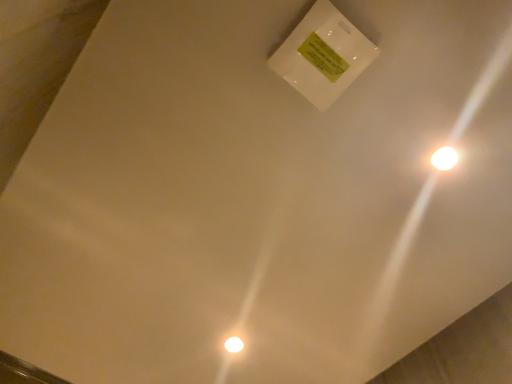
Measure the distance between point (x=234, y=342) and camera.

The depth of point (x=234, y=342) is 4.19 feet.

What do you see at coordinates (234, 344) in the screenshot? The height and width of the screenshot is (384, 512). I see `white glossy light bulb at lower center` at bounding box center [234, 344].

Find the location of a particular element. white glossy light bulb at lower center is located at coordinates (234, 344).

Where is `white glossy light at upper right`? white glossy light at upper right is located at coordinates (444, 158).

Describe the element at coordinates (444, 158) in the screenshot. I see `white glossy light at upper right` at that location.

Measure the distance between white glossy light at upper right and camera.

white glossy light at upper right and camera are 37.83 inches apart.

At what (x,y) coordinates should I click in order to perform the action: click on white glossy light bulb at lower center. Please return your answer as a coordinate pair (x, y). The height and width of the screenshot is (384, 512). Looking at the image, I should click on (234, 344).

Considering the relative positions of white glossy light at upper right and white glossy light bulb at lower center in the image provided, is white glossy light at upper right to the right of white glossy light bulb at lower center from the viewer's perspective?

Indeed, white glossy light at upper right is positioned on the right side of white glossy light bulb at lower center.

Is white glossy light at upper right positioned before white glossy light bulb at lower center?

That is True.

Is point (437, 155) closer or farther from the camera than point (234, 348)?

Clearly, point (437, 155) is closer to the camera than point (234, 348).

From the image's perspective, relative to white glossy light bulb at lower center, is white glossy light at upper right above or below?

Clearly, from the image's perspective, white glossy light at upper right is above white glossy light bulb at lower center.

From a real-world perspective, which object rests below the other?

In real-world perspective, white glossy light bulb at lower center is lower.

Does white glossy light at upper right have a greater width compared to white glossy light bulb at lower center?

No, white glossy light at upper right is not wider than white glossy light bulb at lower center.

Can you confirm if white glossy light at upper right is shorter than white glossy light bulb at lower center?

Yes.

Considering the sizes of white glossy light at upper right and white glossy light bulb at lower center in the image, is white glossy light at upper right bigger or smaller than white glossy light bulb at lower center?

white glossy light at upper right is smaller than white glossy light bulb at lower center.

Would you say white glossy light bulb at lower center is part of white glossy light at upper right's contents?

No, white glossy light bulb at lower center is not inside white glossy light at upper right.

Would you consider white glossy light at upper right to be distant from white glossy light bulb at lower center?

No, there isn't a large distance between white glossy light at upper right and white glossy light bulb at lower center.

Is white glossy light at upper right facing towards white glossy light bulb at lower center?

Yes.

How different are the orientations of white glossy light at upper right and white glossy light bulb at lower center in degrees?

The angle between the facing direction of white glossy light at upper right and the facing direction of white glossy light bulb at lower center is 180 degrees.

Where is `light that appears above the white glossy light bulb at lower center (from a real-world perspective)`? The image size is (512, 384). light that appears above the white glossy light bulb at lower center (from a real-world perspective) is located at coordinates (444, 158).

Is white glossy light bulb at lower center at the left side of white glossy light at upper right?

Correct, you'll find white glossy light bulb at lower center to the left of white glossy light at upper right.

Is white glossy light bulb at lower center behind white glossy light at upper right?

Yes, white glossy light bulb at lower center is behind white glossy light at upper right.

Which is nearer, (240, 348) or (439, 154)?

Point (240, 348).

From the image's perspective, is white glossy light bulb at lower center over white glossy light at upper right?

Actually, white glossy light bulb at lower center appears below white glossy light at upper right in the image.

From a real-world perspective, between white glossy light bulb at lower center and white glossy light at upper right, who is vertically higher?

white glossy light at upper right, from a real-world perspective.

Considering the sizes of white glossy light bulb at lower center and white glossy light at upper right in the image, is white glossy light bulb at lower center wider or thinner than white glossy light at upper right?

Clearly, white glossy light bulb at lower center has more width compared to white glossy light at upper right.

Is white glossy light bulb at lower center shorter than white glossy light at upper right?

No, white glossy light bulb at lower center is not shorter than white glossy light at upper right.

Considering the relative sizes of white glossy light bulb at lower center and white glossy light at upper right in the image provided, is white glossy light bulb at lower center smaller than white glossy light at upper right?

Actually, white glossy light bulb at lower center might be larger than white glossy light at upper right.

Is white glossy light bulb at lower center inside the boundaries of white glossy light at upper right, or outside?

white glossy light bulb at lower center exists outside the volume of white glossy light at upper right.

Is white glossy light bulb at lower center far away from white glossy light at upper right?

white glossy light bulb at lower center is actually quite close to white glossy light at upper right.

Is white glossy light bulb at lower center looking in the opposite direction of white glossy light at upper right?

No.

Locate an element on the screen. The image size is (512, 384). light in front of the white glossy light bulb at lower center is located at coordinates (444, 158).

At what (x,y) coordinates should I click in order to perform the action: click on light located on the right of white glossy light bulb at lower center. Please return your answer as a coordinate pair (x, y). Looking at the image, I should click on (444, 158).

Locate an element on the screen. This screenshot has height=384, width=512. light bulb on the left side of white glossy light at upper right is located at coordinates (234, 344).